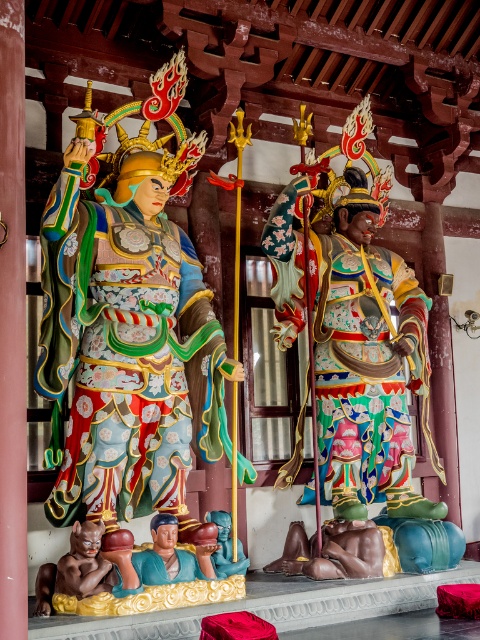
Does multicolored painted statue at center have a lesser height compared to matte brown statue at lower left?

No, multicolored painted statue at center is not shorter than matte brown statue at lower left.

Can you confirm if multicolored painted statue at center is wider than matte brown statue at lower left?

Yes, multicolored painted statue at center is wider than matte brown statue at lower left.

Does point (392, 289) come closer to viewer compared to point (74, 525)?

No, it is behind (74, 525).

This screenshot has width=480, height=640. In order to click on multicolored painted statue at center in this screenshot , I will do `click(365, 364)`.

Can you confirm if multicolored painted statue at center is bigger than smooth blue statue at lower center?

Yes, multicolored painted statue at center is bigger than smooth blue statue at lower center.

Who is more distant from viewer, (406, 484) or (166, 580)?

Point (406, 484)

Identify the location of multicolored painted statue at center. (365, 364).

I want to click on multicolored painted statue at center, so click(365, 364).

Is matte painted statue at left bigger than smooth blue statue at center?

Indeed, matte painted statue at left has a larger size compared to smooth blue statue at center.

Looking at this image, can you confirm if matte painted statue at left is positioned below smooth blue statue at center?

Actually, matte painted statue at left is above smooth blue statue at center.

Who is more forward, (187, 424) or (213, 515)?

Point (187, 424)

Find the location of `matte painted statue at left`. matte painted statue at left is located at coordinates (129, 340).